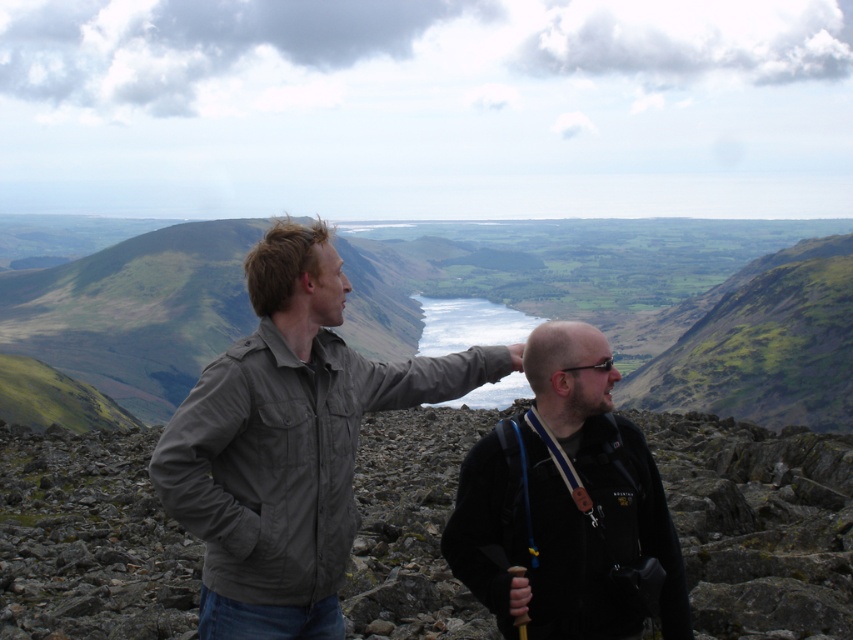
Question: Which object appears closest to the camera in this image?

Choices:
 (A) black fleece jacket at center
 (B) khaki fabric jacket at left

Answer: (A)

Question: Does rough stone boulders at center appear over black fleece jacket at center?

Choices:
 (A) yes
 (B) no

Answer: (B)

Question: Which point appears farthest from the camera in this image?

Choices:
 (A) (219, 468)
 (B) (103, 440)
 (C) (509, 600)

Answer: (B)

Question: Does rough stone boulders at center have a lesser width compared to khaki fabric jacket at left?

Choices:
 (A) yes
 (B) no

Answer: (B)

Question: Estimate the real-world distances between objects in this image. Which object is farther from the khaki fabric jacket at left?

Choices:
 (A) rough stone boulders at center
 (B) black fleece jacket at center

Answer: (A)

Question: Can you confirm if rough stone boulders at center is wider than khaki fabric jacket at left?

Choices:
 (A) no
 (B) yes

Answer: (B)